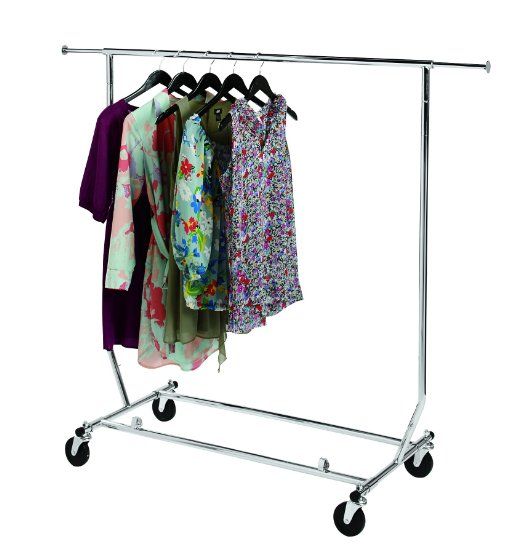
Locate an element on the screen. Image resolution: width=522 pixels, height=553 pixels. black part hanger is located at coordinates (264, 86), (236, 82), (210, 81), (181, 77), (160, 76).